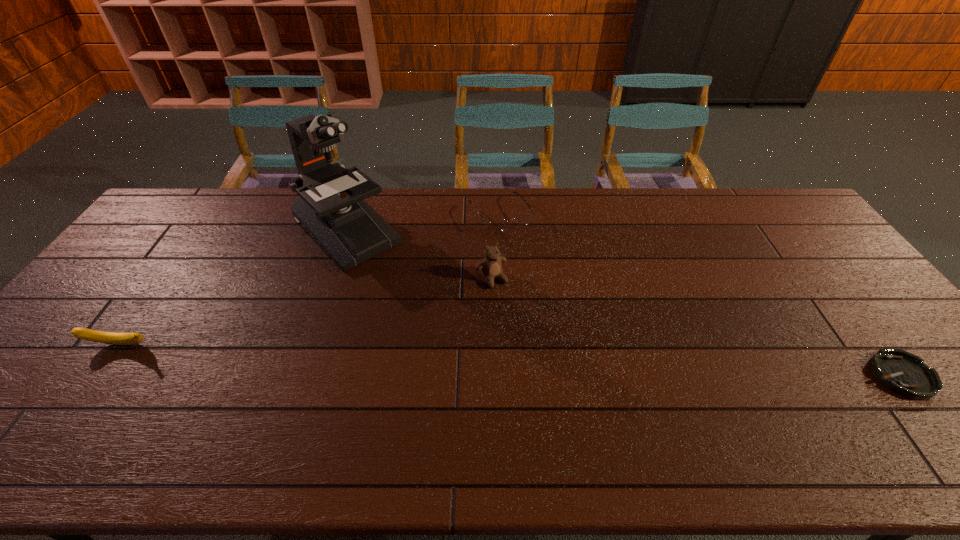
Where is `spectacles that is at the far edge`? Image resolution: width=960 pixels, height=540 pixels. spectacles that is at the far edge is located at coordinates 496,226.

Locate an element on the screen. The width and height of the screenshot is (960, 540). object at the near edge is located at coordinates (904, 373).

This screenshot has height=540, width=960. Identify the location of object positioned at the left edge. (112, 338).

Locate an element on the screen. object at the right edge is located at coordinates (904, 373).

At what (x,y) coordinates should I click in order to perform the action: click on object positioned at the near right corner. Please return your answer as a coordinate pair (x, y). Looking at the image, I should click on (904, 373).

Where is `vacant space at the far edge of the desktop`? The width and height of the screenshot is (960, 540). vacant space at the far edge of the desktop is located at coordinates 252,201.

Identify the location of vacant area at the near edge of the desktop. (139, 397).

Identify the location of free spot at the left edge of the desktop. Image resolution: width=960 pixels, height=540 pixels. (132, 266).

In the image, there is a desktop. What are the coordinates of `blank space at the far left corner` in the screenshot? It's located at click(x=206, y=193).

The image size is (960, 540). Identify the location of blank area at the far right corner. (782, 222).